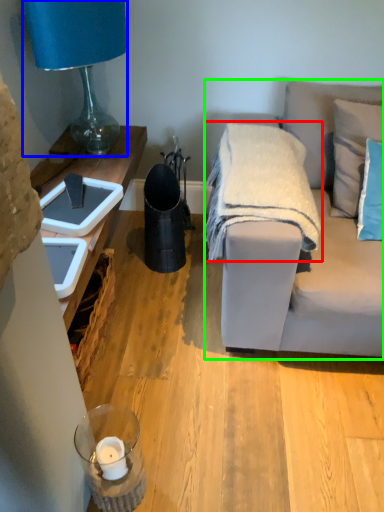
Question: Based on their relative distances, which object is farther from blanket (highlighted by a red box)? Choose from lamp (highlighted by a blue box) and studio couch (highlighted by a green box).

Choices:
 (A) lamp
 (B) studio couch

Answer: (A)